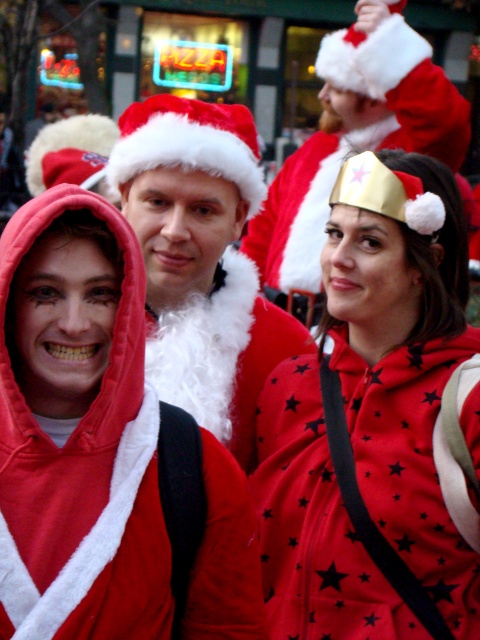
Question: Estimate the real-world distances between objects in this image. Which object is farther from the matte gold crown at center?

Choices:
 (A) red fleece jacket at center
 (B) fuzzy red coat at center
 (C) velvet santa hat at center

Answer: (C)

Question: Which point is closer to the camera taking this photo?

Choices:
 (A) (310, 262)
 (B) (112, 243)

Answer: (B)

Question: Can you confirm if matte gold crown at center is wider than velvet santa hat at center?

Choices:
 (A) yes
 (B) no

Answer: (B)

Question: Can you confirm if matte gold crown at center is thinner than velvet santa hat at center?

Choices:
 (A) yes
 (B) no

Answer: (A)

Question: Can you confirm if matte gold crown at center is positioned to the right of fuzzy red coat at center?

Choices:
 (A) no
 (B) yes

Answer: (B)

Question: Estimate the real-world distances between objects in this image. Which object is farther from the velvet santa hat at center?

Choices:
 (A) matte gold crown at center
 (B) fuzzy red coat at center
 (C) red fleece jacket at center

Answer: (C)